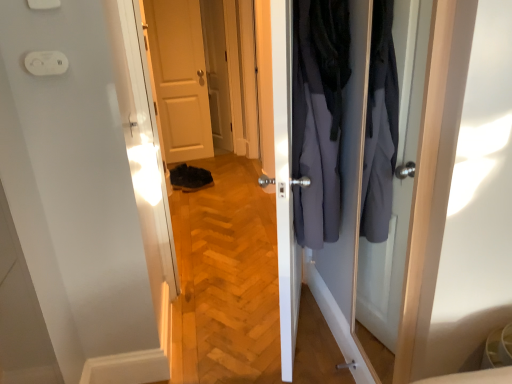
Question: Is black suede shoe at lower center thinner than white plastic electric outlet at upper left?

Choices:
 (A) yes
 (B) no

Answer: (B)

Question: From the image's perspective, is black suede shoe at lower center over white plastic electric outlet at upper left?

Choices:
 (A) no
 (B) yes

Answer: (A)

Question: Does black suede shoe at lower center lie behind white plastic electric outlet at upper left?

Choices:
 (A) no
 (B) yes

Answer: (B)

Question: Does black suede shoe at lower center come in front of white plastic electric outlet at upper left?

Choices:
 (A) no
 (B) yes

Answer: (A)

Question: Considering the relative sizes of black suede shoe at lower center and white plastic electric outlet at upper left in the image provided, is black suede shoe at lower center shorter than white plastic electric outlet at upper left?

Choices:
 (A) no
 (B) yes

Answer: (A)

Question: Is black suede shoe at lower center not within white plastic electric outlet at upper left?

Choices:
 (A) yes
 (B) no

Answer: (A)

Question: Does matte white door at center have a lesser width compared to black suede shoe at lower center?

Choices:
 (A) no
 (B) yes

Answer: (B)

Question: Does matte white door at center have a greater width compared to black suede shoe at lower center?

Choices:
 (A) no
 (B) yes

Answer: (A)

Question: Does matte white door at center touch black suede shoe at lower center?

Choices:
 (A) yes
 (B) no

Answer: (B)

Question: From a real-world perspective, is matte white door at center on top of black suede shoe at lower center?

Choices:
 (A) no
 (B) yes

Answer: (B)

Question: Does matte white door at center have a lesser height compared to black suede shoe at lower center?

Choices:
 (A) yes
 (B) no

Answer: (B)

Question: Can you confirm if matte white door at center is taller than black suede shoe at lower center?

Choices:
 (A) yes
 (B) no

Answer: (A)

Question: From a real-world perspective, is dark gray fabric coat at center positioned under matte white door at center based on gravity?

Choices:
 (A) yes
 (B) no

Answer: (B)